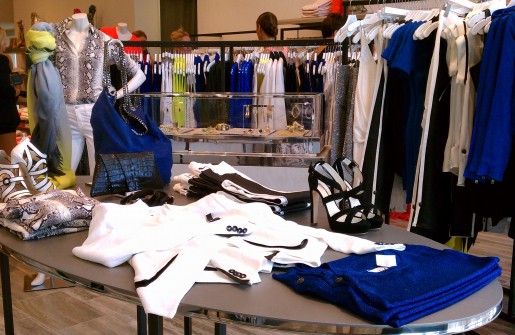
This screenshot has width=515, height=335. What are the coordinates of `clothes hanging` in the screenshot? It's located at (166, 66), (274, 68), (387, 55), (479, 60).